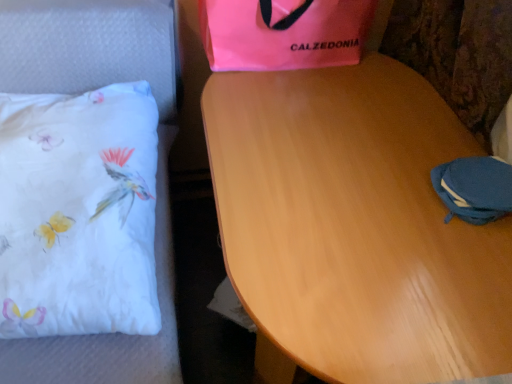
Question: Is the depth of blue fabric pouch at lower right greater than that of light brown wood table at center?

Choices:
 (A) yes
 (B) no

Answer: (A)

Question: Are blue fabric pouch at lower right and light brown wood table at center located far from each other?

Choices:
 (A) no
 (B) yes

Answer: (A)

Question: Can you confirm if blue fabric pouch at lower right is thinner than light brown wood table at center?

Choices:
 (A) yes
 (B) no

Answer: (A)

Question: Is blue fabric pouch at lower right surrounding light brown wood table at center?

Choices:
 (A) yes
 (B) no

Answer: (B)

Question: Is blue fabric pouch at lower right touching light brown wood table at center?

Choices:
 (A) yes
 (B) no

Answer: (B)

Question: From a real-world perspective, is blue fabric pouch at lower right under light brown wood table at center?

Choices:
 (A) no
 (B) yes

Answer: (A)

Question: Is pink fabric bag at upper center at the back of white fabric pillow at left?

Choices:
 (A) yes
 (B) no

Answer: (B)

Question: Can you confirm if white fabric pillow at left is taller than pink fabric bag at upper center?

Choices:
 (A) no
 (B) yes

Answer: (A)

Question: Does white fabric pillow at left appear on the right side of pink fabric bag at upper center?

Choices:
 (A) yes
 (B) no

Answer: (B)

Question: Considering the relative sizes of white fabric pillow at left and pink fabric bag at upper center in the image provided, is white fabric pillow at left wider than pink fabric bag at upper center?

Choices:
 (A) no
 (B) yes

Answer: (B)

Question: Can you confirm if white fabric pillow at left is thinner than pink fabric bag at upper center?

Choices:
 (A) no
 (B) yes

Answer: (A)

Question: Is white fabric pillow at left beside pink fabric bag at upper center?

Choices:
 (A) no
 (B) yes

Answer: (A)

Question: From the image's perspective, is light brown wood table at center beneath white fabric pillow at left?

Choices:
 (A) no
 (B) yes

Answer: (B)